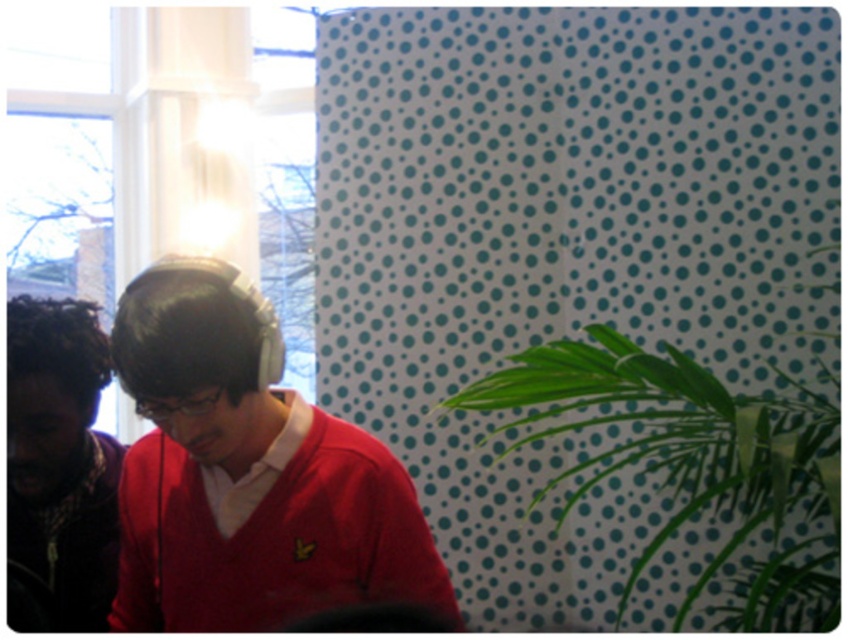
Based on the scene description, where is the green leafy plant at right located in the image?

The green leafy plant at right is located at point (695, 461) in the image.

In the scene shown: You are a fashion designer observing the scene. You need to determine which item is taller between the matte red sweater at center and the dark brown curly hair at left. Which one is taller?

The matte red sweater at center is taller than the dark brown curly hair at left according to the description.

You are standing in the room and want to take a photo of the point at coordinates (544, 349). If your camera has a focal length of 50mm and you are currently 2 meters away from the point, should you move closer or farther away to focus properly?

The point at coordinates (544, 349) is 1.56 meters from the camera. Since you are currently 2 meters away, you need to move closer to 1.56 meters to focus properly.